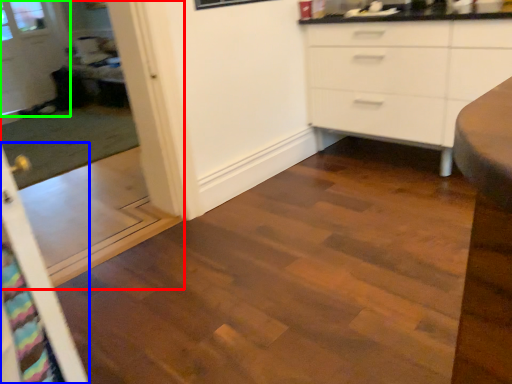
Question: Estimate the real-world distances between objects in this image. Which object is farther from screen door (highlighted by a red box), screen door (highlighted by a blue box) or glass door (highlighted by a green box)?

Choices:
 (A) screen door
 (B) glass door

Answer: (A)